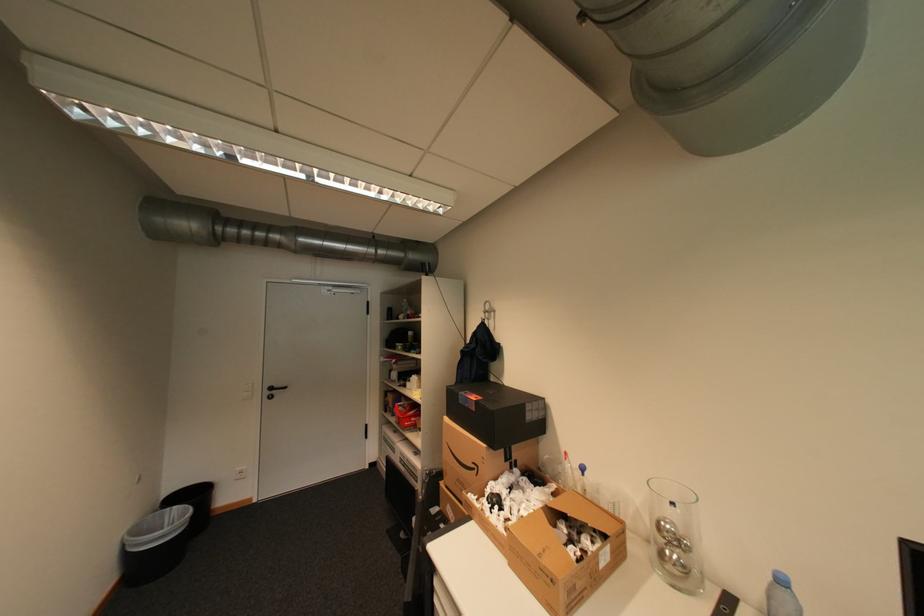
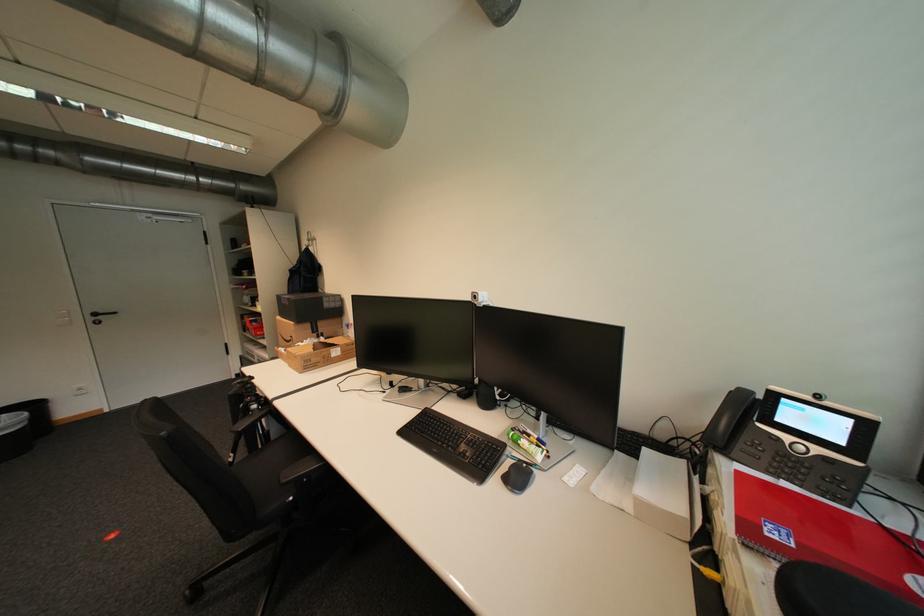
Find the pixel in the second image that matches point (482, 411) in the first image.

(296, 305)